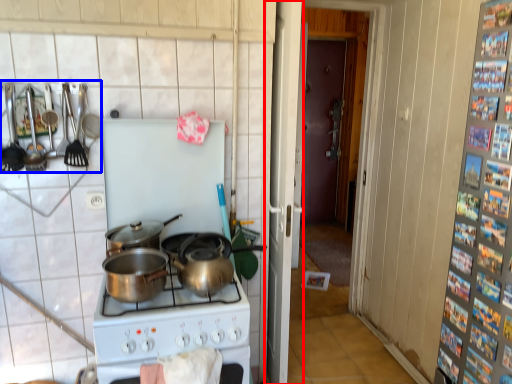
Question: Which point is further to the camera, screen door (highlighted by a red box) or kitchen appliance (highlighted by a blue box)?

Choices:
 (A) screen door
 (B) kitchen appliance

Answer: (A)